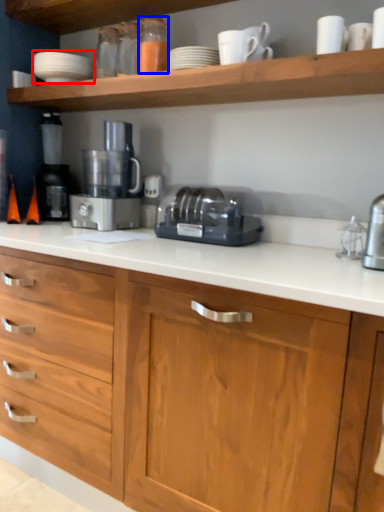
Question: Which object is closer to the camera taking this photo, tableware (highlighted by a red box) or bottle (highlighted by a blue box)?

Choices:
 (A) tableware
 (B) bottle

Answer: (B)